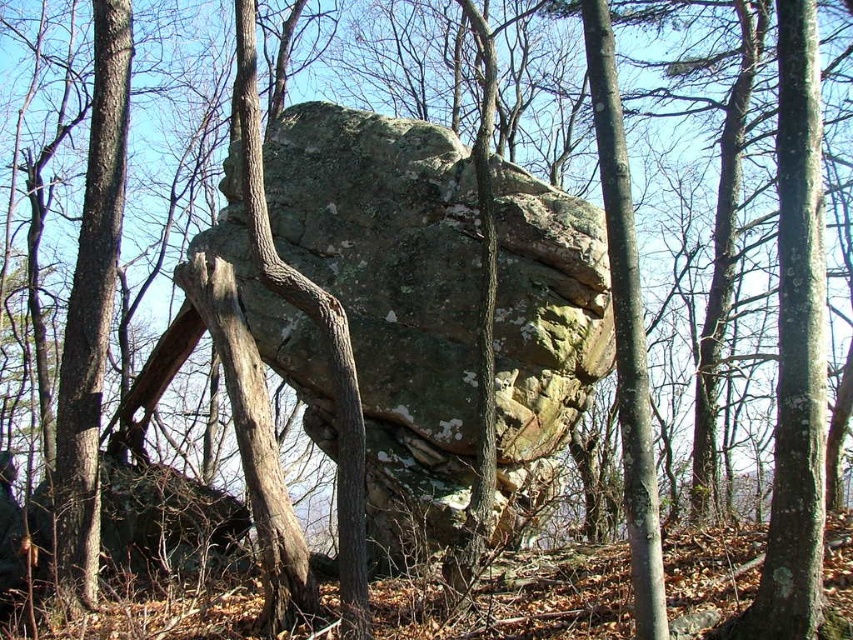
Question: Does lichen-covered rock at center have a smaller size compared to smooth bark tree trunk at center?

Choices:
 (A) no
 (B) yes

Answer: (A)

Question: Does lichen-covered rock at center have a smaller size compared to smooth bark tree trunk at center?

Choices:
 (A) yes
 (B) no

Answer: (B)

Question: Does lichen-covered rock at center lie behind smooth bark tree trunk at center?

Choices:
 (A) yes
 (B) no

Answer: (A)

Question: Which of the following is the closest to the observer?

Choices:
 (A) (608, 163)
 (B) (343, 296)

Answer: (A)

Question: Which object is closer to the camera taking this photo?

Choices:
 (A) smooth bark tree trunk at center
 (B) lichen-covered rock at center

Answer: (A)